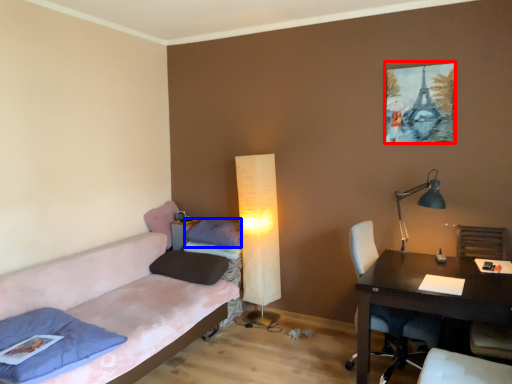
Question: Which object is further to the camera taking this photo, picture frame (highlighted by a red box) or pillow (highlighted by a blue box)?

Choices:
 (A) picture frame
 (B) pillow

Answer: (B)